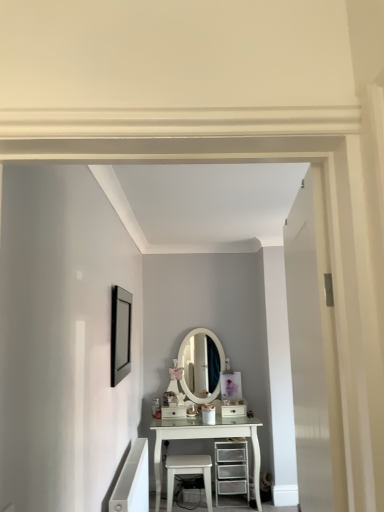
Question: Is white glossy drawer at center, marked as the 2th drawer in a right-to-left arrangement, wider or thinner than white glossy drawer at center, which ranks as the 1th drawer in right-to-left order?

Choices:
 (A) thin
 (B) wide

Answer: (A)

Question: Is white glossy drawer at center, marked as the 2th drawer in a right-to-left arrangement, bigger or smaller than white glossy drawer at center, positioned as the 2th drawer in left-to-right order?

Choices:
 (A) big
 (B) small

Answer: (A)

Question: Estimate the real-world distances between objects in this image. Which object is farther from the white matte door at right?

Choices:
 (A) white glossy drawer at center, marked as the 2th drawer in a right-to-left arrangement
 (B) white glossy stool at lower center
 (C) clear plastic drawers at center
 (D) white glossy drawer at center, which ranks as the 1th drawer in right-to-left order
 (E) matte black picture frame at upper left

Answer: (A)

Question: Estimate the real-world distances between objects in this image. Which object is closer to the matte black picture frame at upper left?

Choices:
 (A) white glossy drawer at center, marked as the 2th drawer in a right-to-left arrangement
 (B) white matte door at right
 (C) clear plastic drawers at center
 (D) white glossy stool at lower center
 (E) white glossy drawer at center, which ranks as the 1th drawer in right-to-left order

Answer: (D)